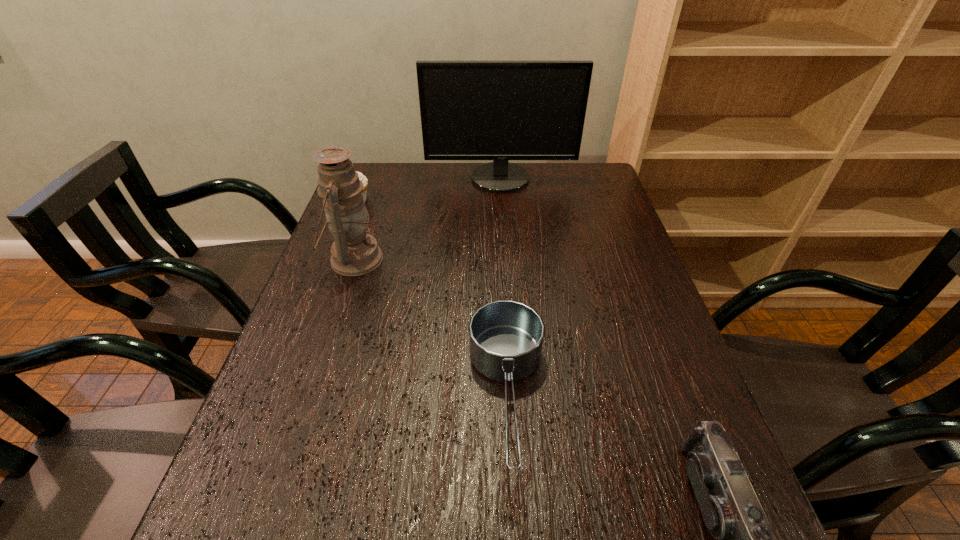
Identify the location of muffin that is at the far edge. (363, 178).

You are a GUI agent. You are given a task and a screenshot of the screen. Output one action in this format:
    pyautogui.click(x=<x>, y=<y>)
    Task: Click on the oil lamp at the left edge
    
    Given the screenshot: What is the action you would take?
    pyautogui.click(x=354, y=252)

Where is `muffin positioned at the left edge`? muffin positioned at the left edge is located at coordinates (363, 178).

The width and height of the screenshot is (960, 540). Find the location of `object present at the right edge`. object present at the right edge is located at coordinates (470, 110).

Locate an element on the screen. The height and width of the screenshot is (540, 960). object that is at the far left corner is located at coordinates (363, 178).

Image resolution: width=960 pixels, height=540 pixels. I want to click on object present at the far right corner, so click(470, 110).

You are a GUI agent. You are given a task and a screenshot of the screen. Output one action in this format:
    pyautogui.click(x=<x>, y=<y>)
    Task: Click on the vacant space at the far edge of the desktop
    This screenshot has width=960, height=540.
    Given the screenshot: What is the action you would take?
    pyautogui.click(x=419, y=199)

The image size is (960, 540). Identify the location of free space at the left edge of the desktop. (306, 354).

Find the location of a particular element. The width and height of the screenshot is (960, 540). free space at the right edge of the desktop is located at coordinates coord(615,202).

In the image, there is a desktop. Where is `vacant area at the far left corner`? vacant area at the far left corner is located at coordinates (368, 199).